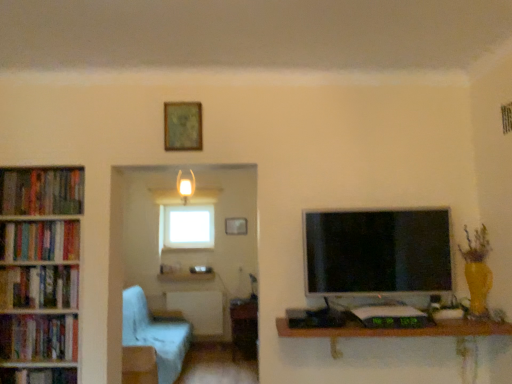
Question: Looking at the image, does hardcover books at left, acting as the 4th book starting from the top, seem bigger or smaller compared to wooden picture frame at center, positioned as the 2th picture frame in top-to-bottom order?

Choices:
 (A) big
 (B) small

Answer: (A)

Question: Visually, is hardcover books at left, placed as the 2th book when sorted from bottom to top, positioned to the left or to the right of wooden picture frame at center, which appears as the first picture frame when viewed from the back?

Choices:
 (A) left
 (B) right

Answer: (A)

Question: Which object is positioned closest to the matte green frame at upper center, which is the 1th picture frame from front to back?

Choices:
 (A) hardcover books at left, the fifth book ordered from the bottom
 (B) hardcover book at left, acting as the first book starting from the bottom
 (C) hardcover books at left, acting as the 4th book starting from the top
 (D) wooden picture frame at center, positioned as the 2th picture frame in top-to-bottom order
 (E) wooden table at center, which ranks as the first table in bottom-to-top order

Answer: (A)

Question: Estimate the real-world distances between objects in this image. Which object is farther from the matte green frame at upper center, the second picture frame from the bottom?

Choices:
 (A) hardcover books at left, the fourth book in the bottom-to-top sequence
 (B) hardcover books at left, the fifth book ordered from the bottom
 (C) matte black monitor at right
 (D) matte glass lampshade at upper center
 (E) wooden bookshelf at left

Answer: (D)